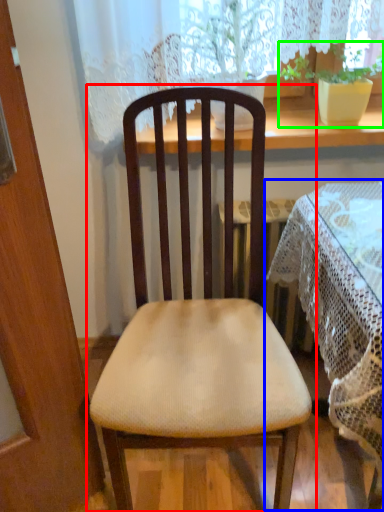
Question: Based on their relative distances, which object is nearer to chair (highlighted by a red box)? Choose from table (highlighted by a blue box) and houseplant (highlighted by a green box).

Choices:
 (A) table
 (B) houseplant

Answer: (A)